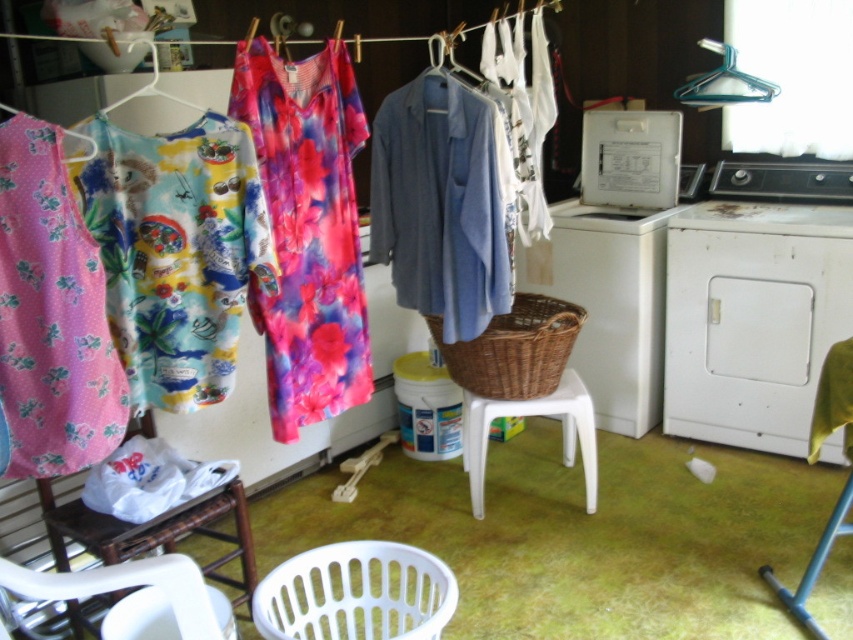
The image size is (853, 640). What do you see at coordinates (177, 252) in the screenshot? I see `fluffy fabric dress at left` at bounding box center [177, 252].

Who is more distant from viewer, (85, 163) or (108, 600)?

Positioned behind is point (108, 600).

Does point (186, 262) come closer to viewer compared to point (158, 532)?

Yes, it is in front of point (158, 532).

Identify the location of fluffy fabric dress at left. This screenshot has height=640, width=853. (177, 252).

In the scene shown: Who is higher up, white matte washing machine at right or metallic blue hanger at upper right?

Positioned higher is metallic blue hanger at upper right.

Which of these two, white matte washing machine at right or metallic blue hanger at upper right, stands shorter?

metallic blue hanger at upper right

Which is in front, point (666, 307) or point (697, 100)?

Point (666, 307) is more forward.

This screenshot has width=853, height=640. Identify the location of white matte washing machine at right. (756, 301).

Does white plastic chair at lower left appear on the left side of metallic blue chair at lower right?

Correct, you'll find white plastic chair at lower left to the left of metallic blue chair at lower right.

Is the position of white plastic chair at lower left more distant than that of metallic blue chair at lower right?

No.

Is point (165, 577) farther from camera compared to point (811, 416)?

No, it is in front of (811, 416).

I want to click on white plastic chair at lower left, so click(x=126, y=588).